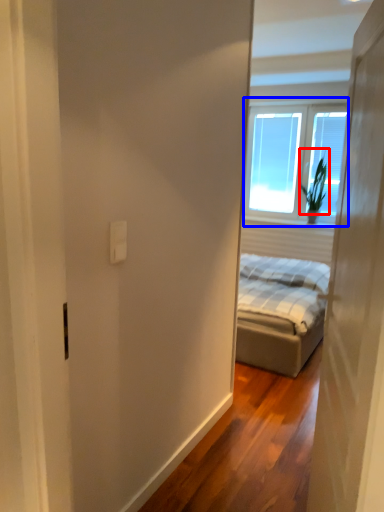
Question: Which object is further to the camera taking this photo, plant (highlighted by a red box) or window (highlighted by a blue box)?

Choices:
 (A) plant
 (B) window

Answer: (A)